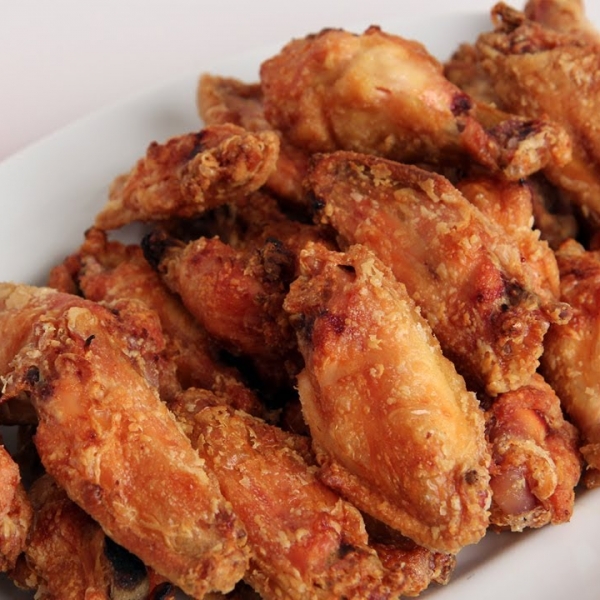
The height and width of the screenshot is (600, 600). Find the location of `plate`. plate is located at coordinates (54, 173).